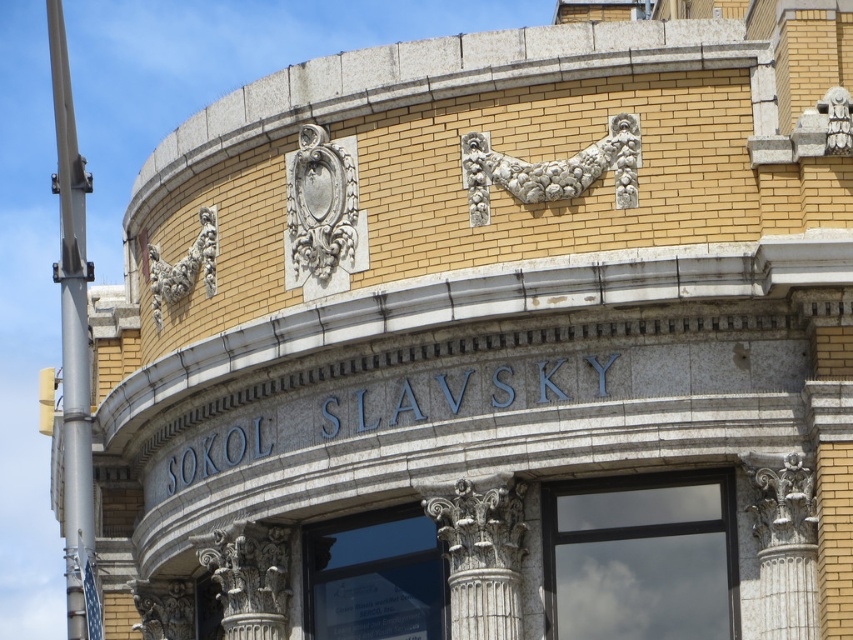
Describe the element at coordinates (323, 214) in the screenshot. This screenshot has width=853, height=640. I see `white stone ornament at center` at that location.

Find the location of a particular element. white stone ornament at center is located at coordinates (323, 214).

Who is shorter, white stone ornament at center or white stone column at center?

white stone column at center

Does point (323, 216) come closer to viewer compared to point (264, 561)?

Yes, it is.

I want to click on white stone ornament at center, so click(x=323, y=214).

Which is in front, point (78, 268) or point (328, 250)?

Point (328, 250) is more forward.

Which is behind, point (85, 612) or point (305, 144)?

The point (305, 144) is behind.

Where is `metallic pole at left`? This screenshot has width=853, height=640. metallic pole at left is located at coordinates (73, 342).